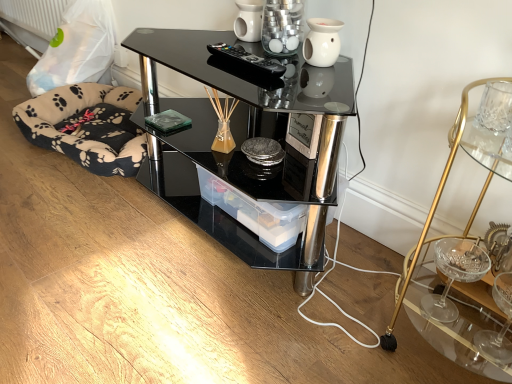
At what (x,y) coordinates should I click in order to perform the action: click on free area in between black glass desk at center and gold metallic cocktail table at right. Please return your answer as a coordinate pair (x, y). Looking at the image, I should click on (364, 297).